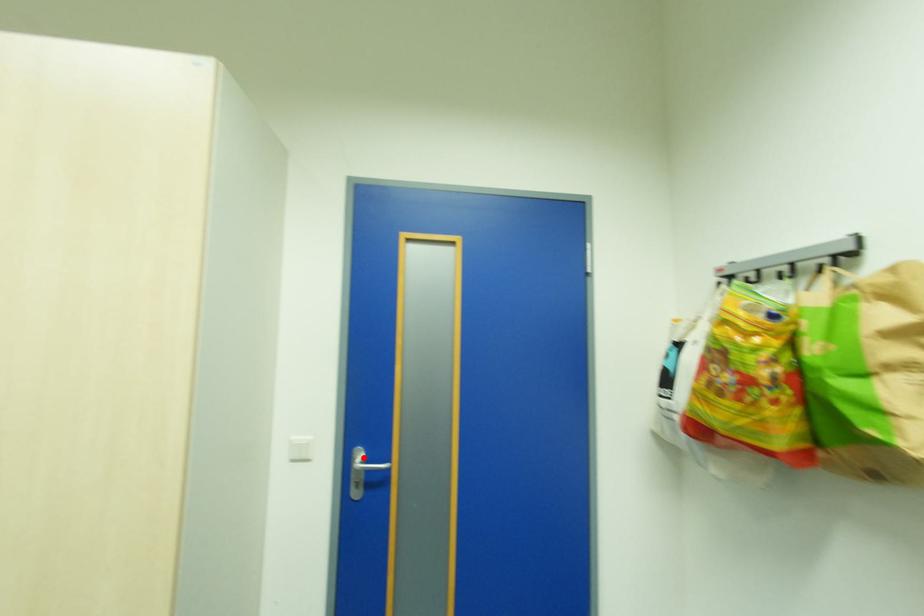
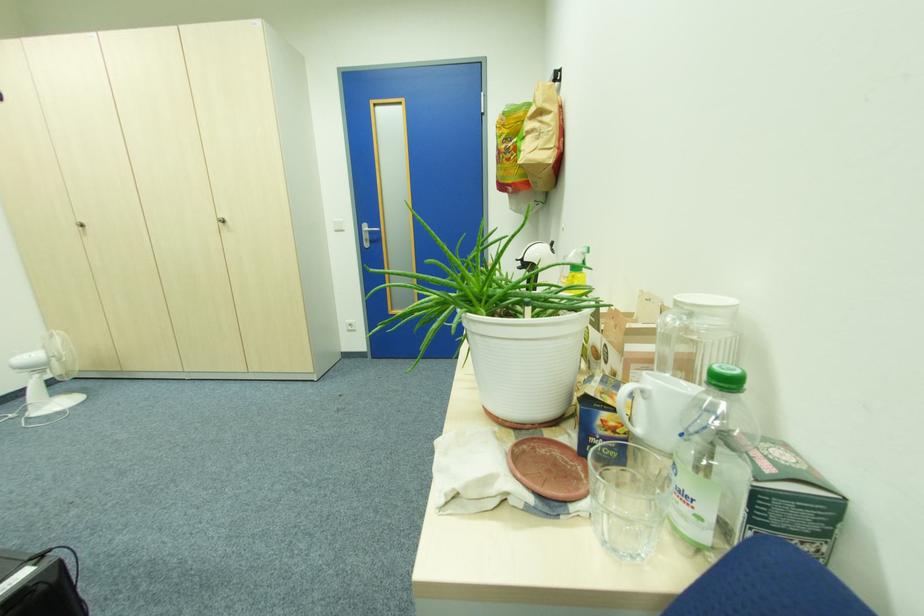
Where in the second image is the point corresponding to the highlighted location from the first image?

(371, 229)